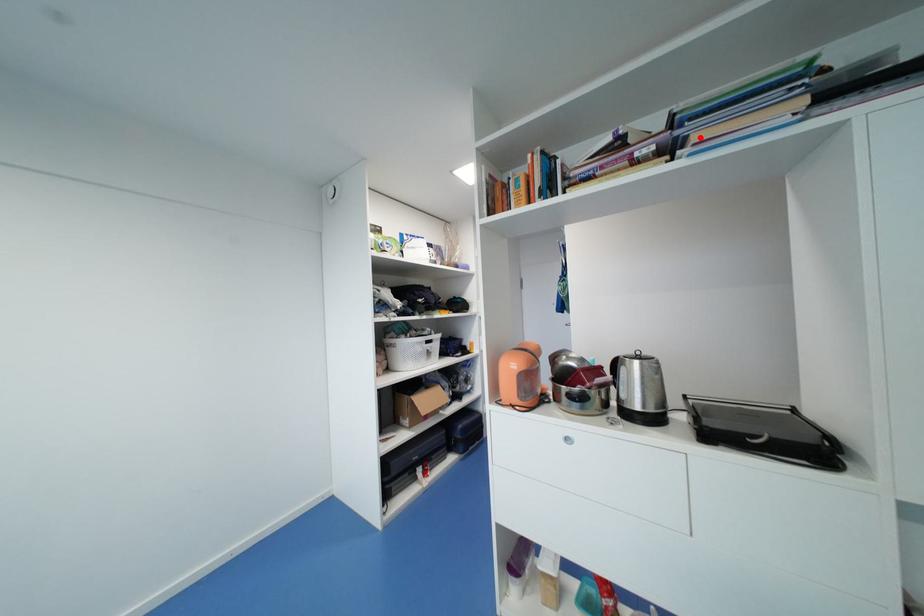
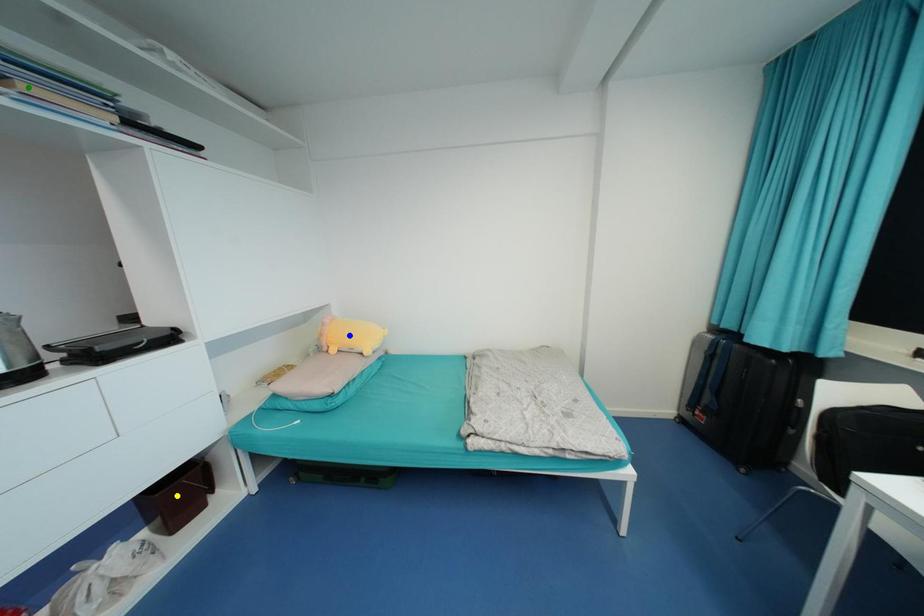
Question: I am providing you with two images of the same scene from different viewpoints. A red point is marked on the first image. You are given multiple points on the second image. Which point in image 2 represents the same 3d spot as the red point in image 1?

Choices:
 (A) green point
 (B) yellow point
 (C) blue point

Answer: (A)